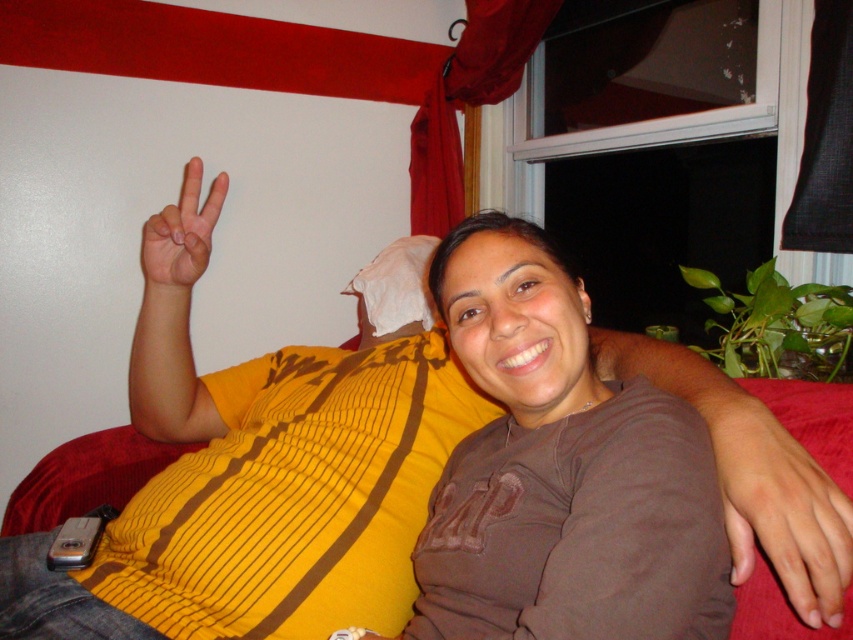
Is point (805, 506) positioned after point (172, 268)?

No, it is not.

Does pale skin hand at center come behind matte yellow hand at upper left?

No, pale skin hand at center is closer to the viewer.

In order to click on pale skin hand at center in this screenshot , I will do pyautogui.click(x=799, y=513).

Which is behind, point (506, 253) or point (757, 476)?

Point (506, 253)

Who is shorter, brown soft shirt at center or pale skin hand at center?

pale skin hand at center

Measure the distance between point (653,428) and camera.

Point (653,428) and camera are 28.92 inches apart from each other.

This screenshot has width=853, height=640. In order to click on brown soft shirt at center in this screenshot , I will do `click(560, 472)`.

Between brown soft shirt at center and matte yellow hand at upper left, which one has more height?

With more height is brown soft shirt at center.

How far apart are brown soft shirt at center and matte yellow hand at upper left?

brown soft shirt at center and matte yellow hand at upper left are 21.53 inches apart.

Which is in front, point (537, 586) or point (170, 205)?

Point (537, 586) is more forward.

Locate an element on the screen. The image size is (853, 640). brown soft shirt at center is located at coordinates (560, 472).